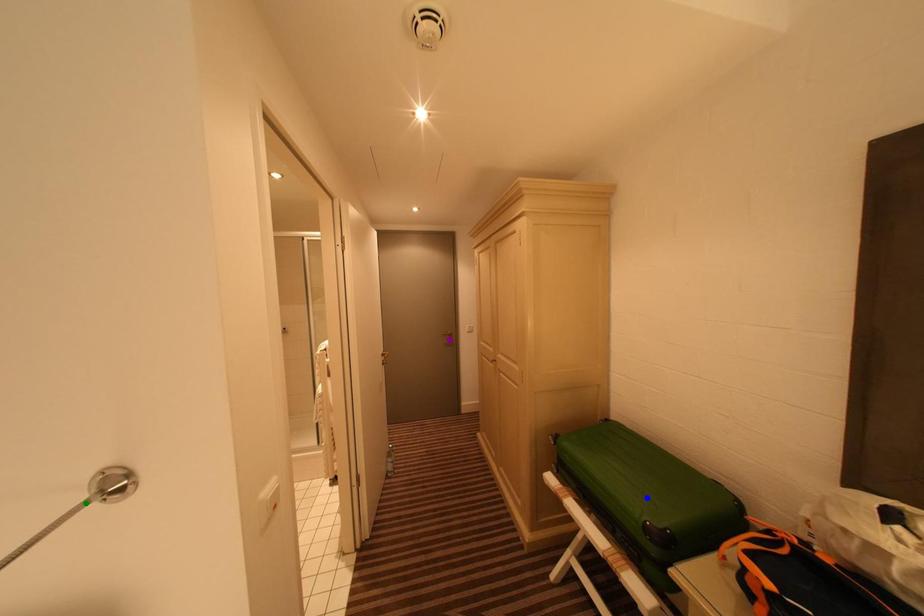
Order these from nearest to farthest:
green point, purple point, blue point

green point → blue point → purple point